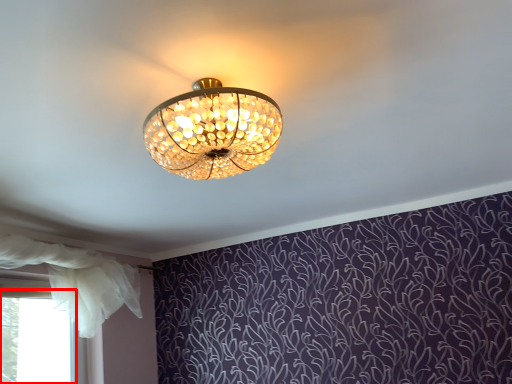
Question: From the image's perspective, what is the correct spatial positioning of bay window (annotated by the red box) in reference to curtain?

Choices:
 (A) below
 (B) above

Answer: (A)